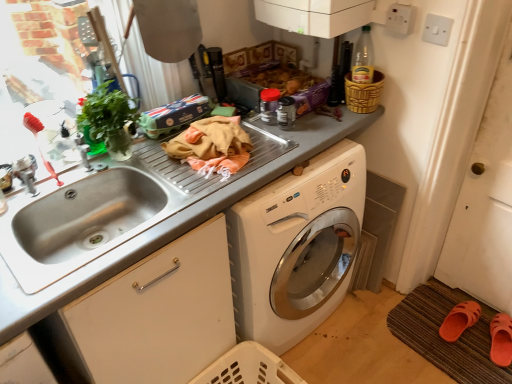
I want to click on unoccupied space behind orange rubber slipper at lower right, so click(x=438, y=299).